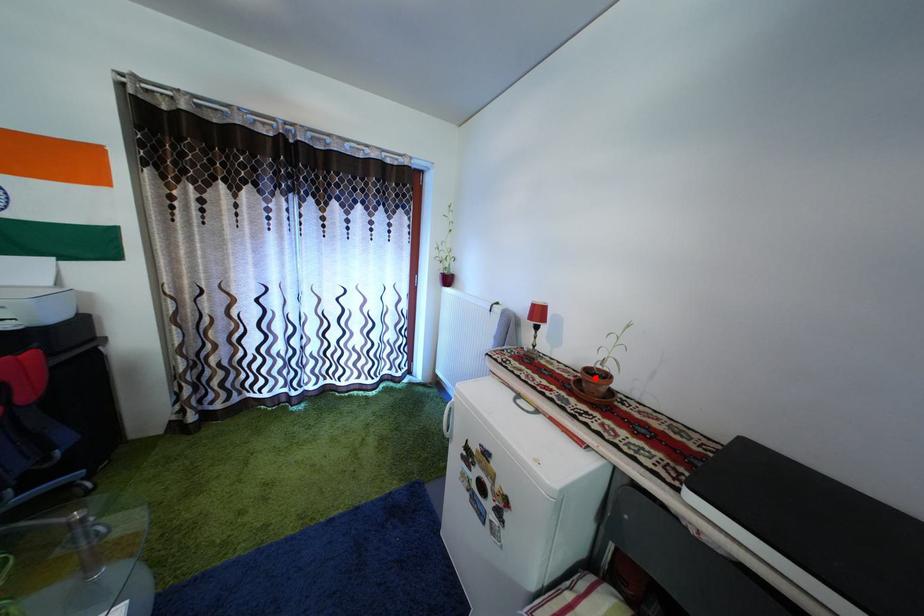
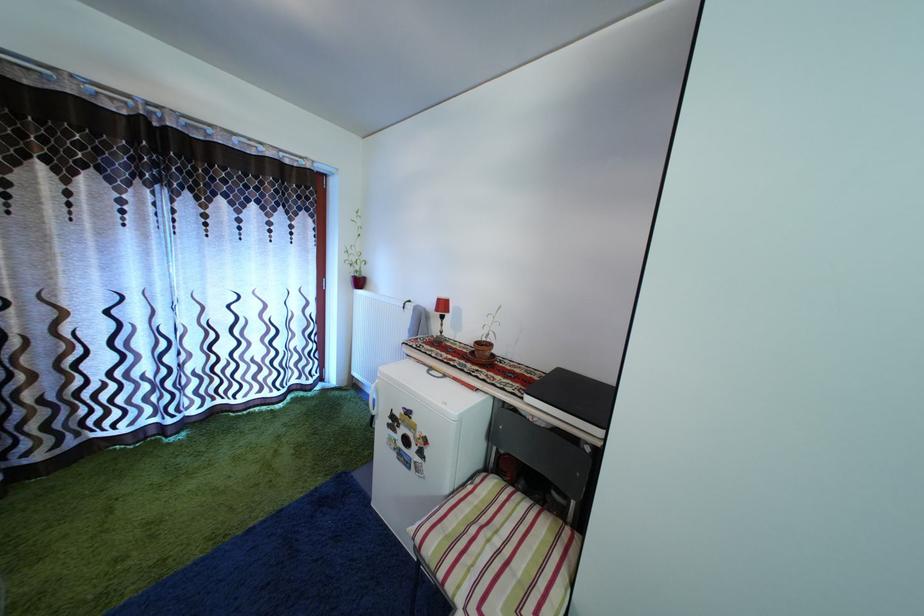
Where in the second image is the point corresponding to the highlighted location from the first image?

(485, 350)